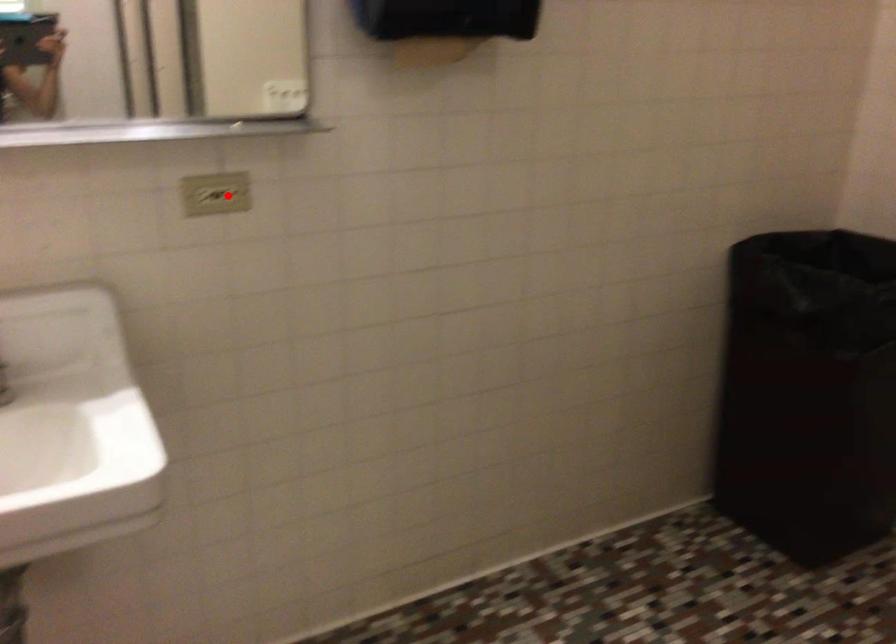
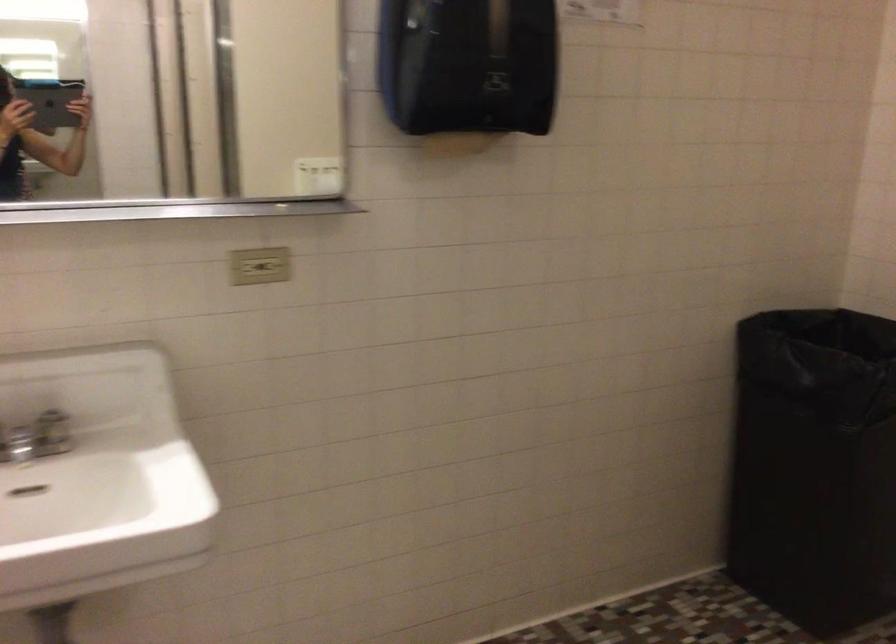
In the second image, find the point that corresponds to the highlighted location in the first image.

(273, 266)